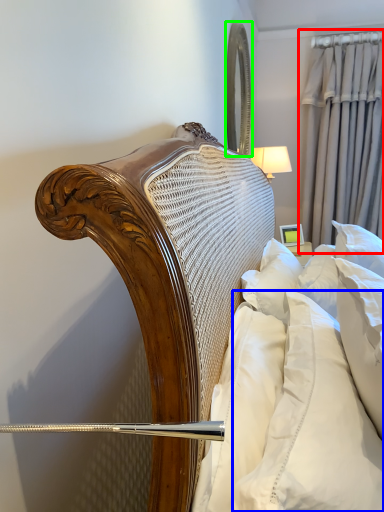
Question: Based on their relative distances, which object is nearer to curtain (highlighted by a red box)? Choose from pillow (highlighted by a blue box) and mirror (highlighted by a green box).

Choices:
 (A) pillow
 (B) mirror

Answer: (B)